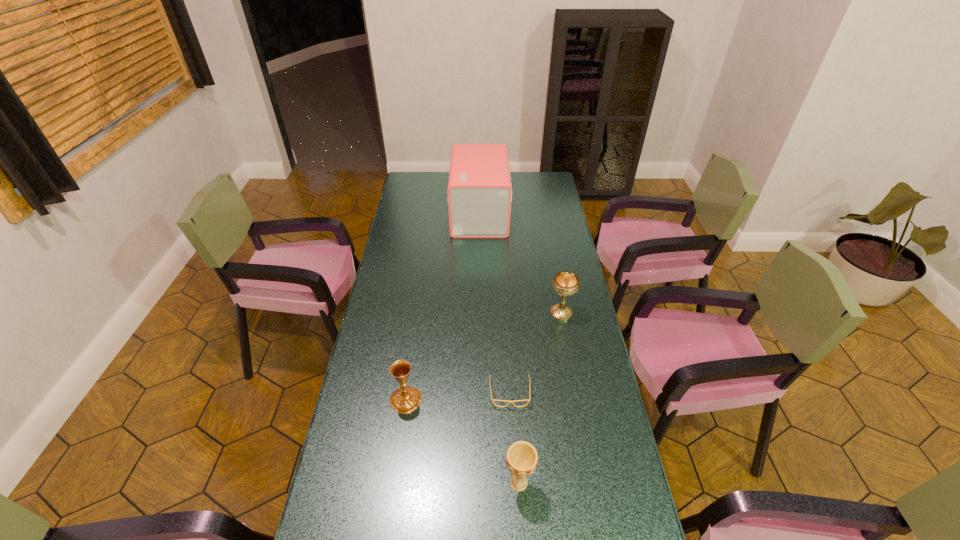
The image size is (960, 540). I want to click on blank space located 0.390m on the back of the farthest chalice, so click(x=548, y=244).

Identify the location of free space located 0.210m on the back of the leftmost chalice. (415, 338).

Locate an element on the screen. This screenshot has width=960, height=540. vacant region located 0.080m on the back of the second chalice from left to right is located at coordinates (516, 442).

Locate an element on the screen. This screenshot has width=960, height=540. free location located in front of the lenses of the spectacles is located at coordinates (515, 470).

This screenshot has width=960, height=540. I want to click on object at the far edge, so click(x=479, y=192).

Find the location of `object positioned at the left edge`. object positioned at the left edge is located at coordinates (406, 399).

In order to click on object located at the right edge in this screenshot , I will do [565, 283].

I want to click on vacant space at the left edge of the desktop, so click(360, 532).

Locate an element on the screen. Image resolution: width=960 pixels, height=540 pixels. vacant space at the right edge of the desktop is located at coordinates (566, 235).

Identify the location of vacant space that's between the tallest object and the second farthest chalice. (443, 307).